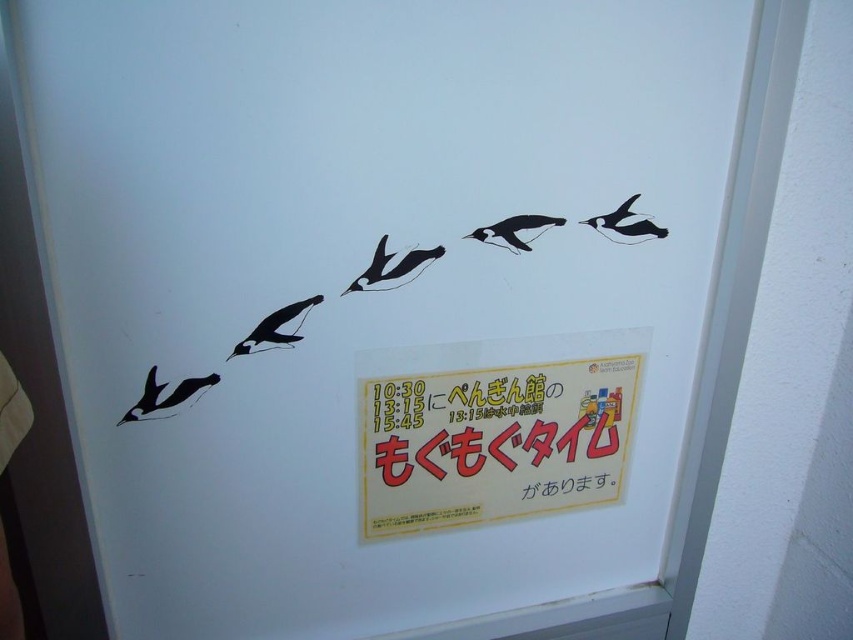
Question: Is black glossy penguin at upper center smaller than black glossy penguin at upper right?

Choices:
 (A) yes
 (B) no

Answer: (A)

Question: Which of the following is the farthest from the observer?

Choices:
 (A) (611, 224)
 (B) (525, 380)
 (C) (553, 225)

Answer: (B)

Question: Which object is closer to the camera taking this photo?

Choices:
 (A) black glossy penguin at upper center
 (B) black paper at lower center

Answer: (A)

Question: Which of these objects is positioned closest to the black glossy penguin at center?

Choices:
 (A) black glossy penguin at upper left
 (B) black glossy penguin at upper right

Answer: (A)

Question: Does black paper at lower center have a larger size compared to black matte penguin at lower left?

Choices:
 (A) yes
 (B) no

Answer: (A)

Question: Does yellow paper sign at center have a greater width compared to black glossy penguin at upper center?

Choices:
 (A) yes
 (B) no

Answer: (A)